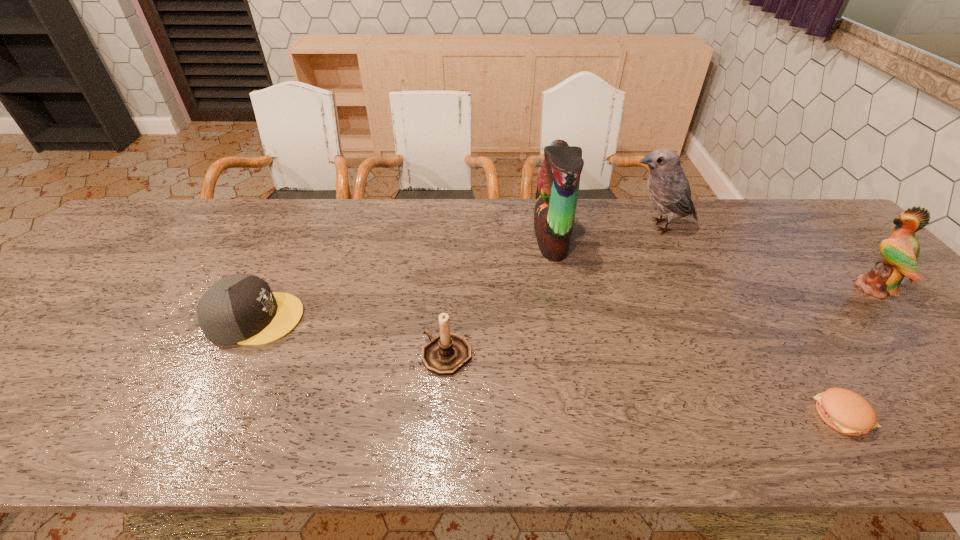
I want to click on free space located 0.160m at the face of the third object from left to right, so click(481, 239).

The height and width of the screenshot is (540, 960). Find the location of `free space located 0.380m at the face of the third object from left to right`. free space located 0.380m at the face of the third object from left to right is located at coordinates (407, 239).

At what (x,y) coordinates should I click in order to perform the action: click on free point located 0.120m at the face of the third object from left to right. Please return your answer as a coordinate pair (x, y). The image size is (960, 540). Looking at the image, I should click on [494, 239].

At what (x,y) coordinates should I click in order to perform the action: click on vacant space situated 0.280m on the front-facing side of the second parrot from left to right. Please return your answer as a coordinate pair (x, y). The image size is (960, 540). Looking at the image, I should click on (532, 226).

Find the location of a particular element. free point located 0.340m on the front-facing side of the second parrot from left to right is located at coordinates coord(513,226).

Image resolution: width=960 pixels, height=540 pixels. Identify the location of vacant region located 0.220m on the front-facing side of the second parrot from left to right. (551, 226).

Locate an element on the screen. This screenshot has height=540, width=960. vacant space located on the front-facing side of the rightmost parrot is located at coordinates (737, 288).

Locate an element on the screen. The width and height of the screenshot is (960, 540). free space located on the front-facing side of the rightmost parrot is located at coordinates [820, 288].

Find the location of a particular element. The image size is (960, 540). vacant area situated on the front-facing side of the rightmost parrot is located at coordinates (824, 288).

Where is `vacant area located on the left of the candle holder`? The width and height of the screenshot is (960, 540). vacant area located on the left of the candle holder is located at coordinates (325, 355).